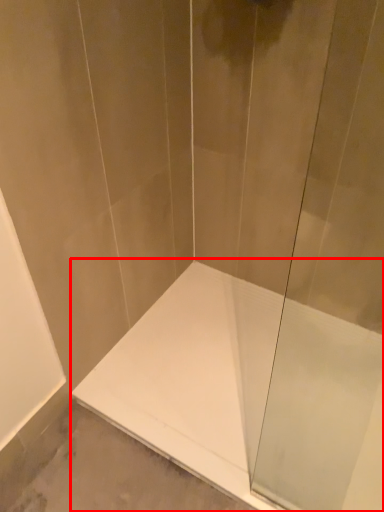
Question: In this image, where is bathtub (annotated by the red box) located relative to shower door?

Choices:
 (A) right
 (B) left

Answer: (B)